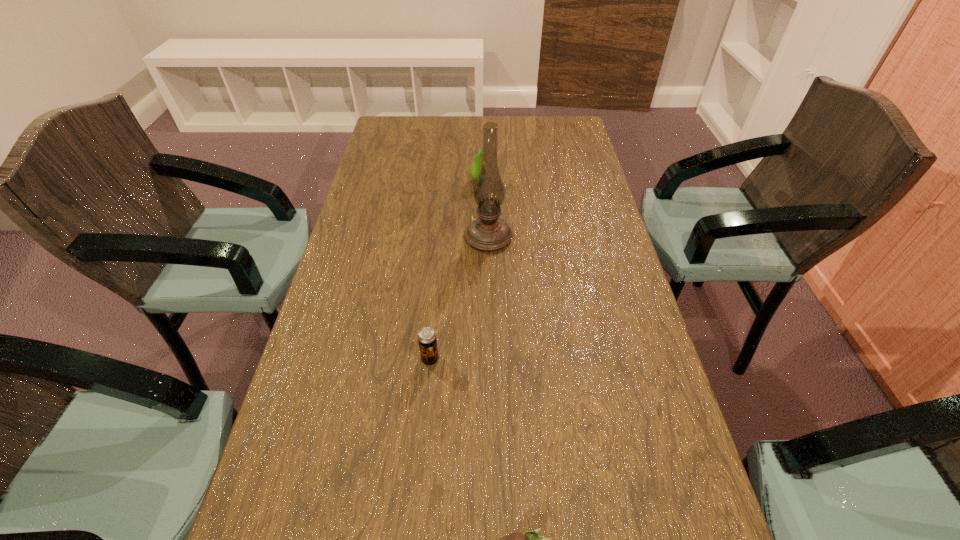
I want to click on the tallest object, so click(x=488, y=232).

Image resolution: width=960 pixels, height=540 pixels. I want to click on the third nearest object, so click(x=488, y=232).

The image size is (960, 540). What are the coordinates of `the left avocado` in the screenshot? It's located at (476, 165).

You are a GUI agent. You are given a task and a screenshot of the screen. Output one action in this format:
    pyautogui.click(x=<x>, y=<y>)
    Task: Click on the taller avocado
    The height and width of the screenshot is (540, 960).
    Given the screenshot: What is the action you would take?
    pyautogui.click(x=476, y=165)

Identify the location of the leftmost object. This screenshot has height=540, width=960. click(x=427, y=340).

Where is `the second nearest object`? The width and height of the screenshot is (960, 540). the second nearest object is located at coordinates (427, 340).

Locate an element on the screen. The image size is (960, 540). free space located on the front of the third nearest object is located at coordinates (490, 301).

Locate an element on the screen. Image resolution: width=960 pixels, height=540 pixels. free space located 0.190m on the cut side of the farthest object is located at coordinates 545,182.

You are a GUI agent. You are given a task and a screenshot of the screen. Output one action in this format:
    pyautogui.click(x=<x>, y=<y>)
    Task: Click on the vacant area situated 0.070m on the front of the leftmost object
    The image size is (960, 540).
    Given the screenshot: What is the action you would take?
    pyautogui.click(x=426, y=396)

Locate an element on the screen. vacant space at the far edge of the desktop is located at coordinates (484, 119).